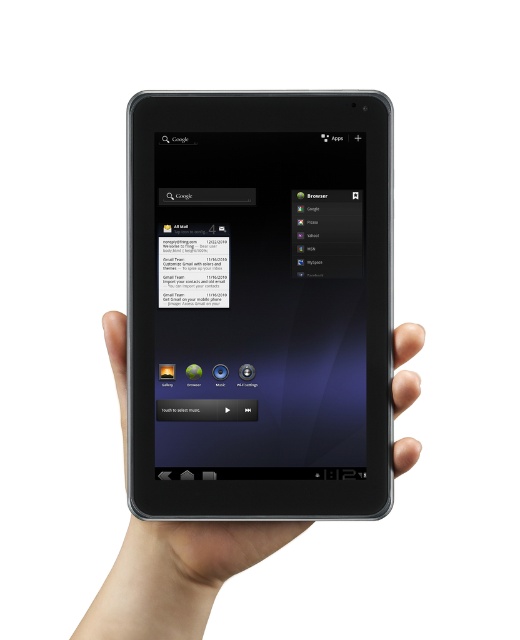
You are holding a tablet and want to reach the point at point (369, 442) from your current position. The tablet screen is 12 inches wide. Can you estimate if your finger can comfortably reach that point without moving your hand?

The distance between your current position and the point (369, 442) is 16.57 inches. Since the tablet screen is only 12 inches wide, reaching 16.57 inches would require moving your hand, so it might not be comfortable to reach without moving.

You are designing a phone case that needs to fit over the black matte tablet at center and the smooth skin hand at center. Considering their sizes, will the case need to be larger in height to accommodate both?

The black matte tablet at center is taller than the smooth skin hand at center, so the case needs to be larger in height to accommodate the tablet.

What is the position of the point with coordinates point (260, 305) in relation to the black matte tablet at center?

The point (260, 305) is on the black matte tablet at center.